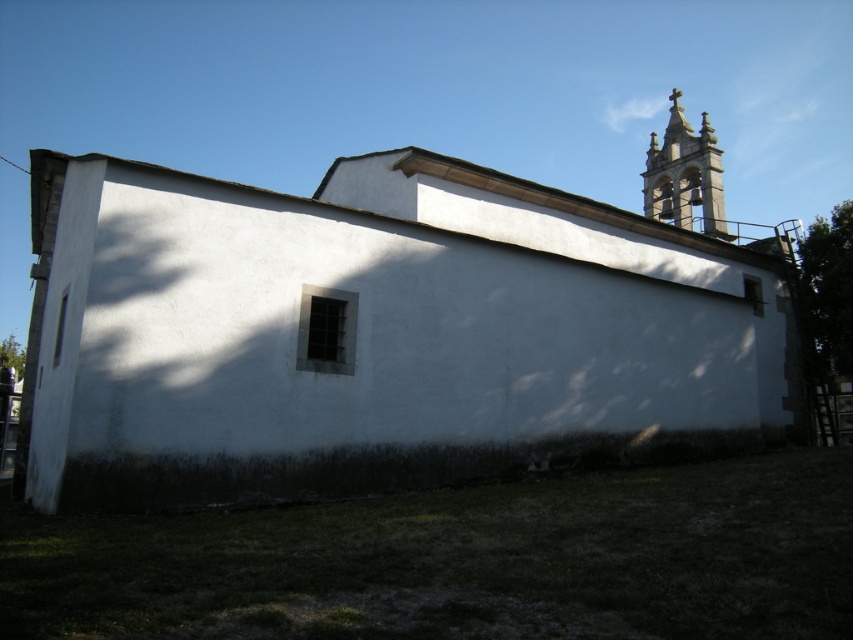
Does white matte church at center come behind smooth stone bell tower at upper right?

No, it is in front of smooth stone bell tower at upper right.

Does white matte church at center appear under smooth stone bell tower at upper right?

Yes, white matte church at center is below smooth stone bell tower at upper right.

Locate an element on the screen. The width and height of the screenshot is (853, 640). white matte church at center is located at coordinates (376, 333).